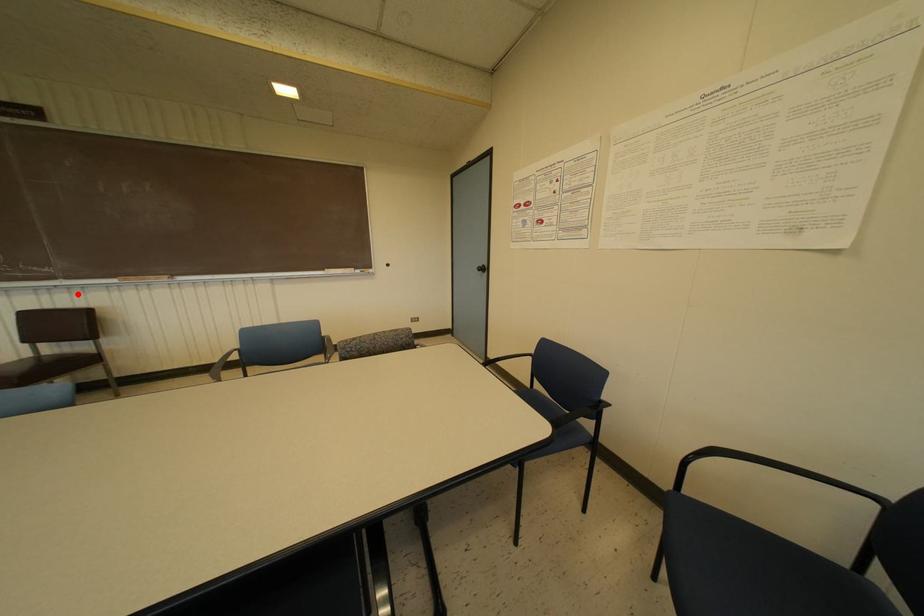
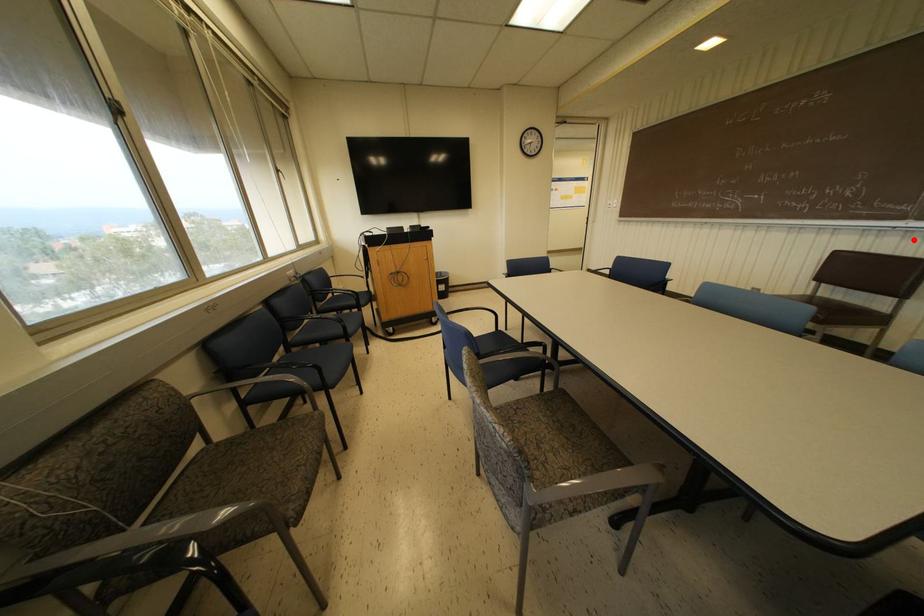
I am providing you with two images of the same scene from different viewpoints. A red point is marked on the first image and another point is marked on the second image. Do the highlighted points in image1 and image2 indicate the same real-world spot?

Yes